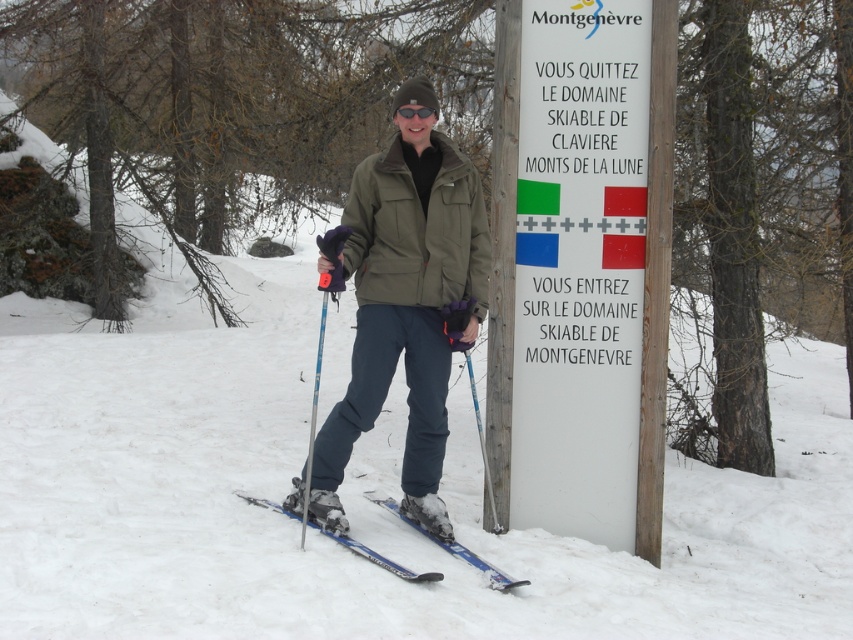
Which is more to the left, olive-green fabric jacket at center or blue metallic ski pole at lower center?

Positioned to the left is blue metallic ski pole at lower center.

Which is below, olive-green fabric jacket at center or blue metallic ski pole at lower center?

blue metallic ski pole at lower center

Image resolution: width=853 pixels, height=640 pixels. Describe the element at coordinates (404, 301) in the screenshot. I see `olive-green fabric jacket at center` at that location.

Image resolution: width=853 pixels, height=640 pixels. Identify the location of olive-green fabric jacket at center. (404, 301).

Does blue metallic skis at lower center have a lesser width compared to blue metallic ski pole at lower center?

Yes.

Can you confirm if blue metallic skis at lower center is wider than blue metallic ski pole at lower center?

→ Incorrect, blue metallic skis at lower center's width does not surpass blue metallic ski pole at lower center's.

You are a GUI agent. You are given a task and a screenshot of the screen. Output one action in this format:
    pyautogui.click(x=<x>, y=<y>)
    Task: Click on the blue metallic skis at lower center
    Image resolution: width=853 pixels, height=640 pixels.
    Given the screenshot: What is the action you would take?
    pyautogui.click(x=450, y=545)

Can you confirm if blue metallic ski pole at lower center is positioned below black matte goggles at center?

Correct, blue metallic ski pole at lower center is located below black matte goggles at center.

Does blue metallic ski pole at lower center have a larger size compared to black matte goggles at center?

Yes, blue metallic ski pole at lower center is bigger than black matte goggles at center.

Locate an element on the screen. This screenshot has width=853, height=640. blue metallic ski pole at lower center is located at coordinates (322, 340).

Where is `blue metallic ski pole at lower center`? This screenshot has width=853, height=640. blue metallic ski pole at lower center is located at coordinates (322, 340).